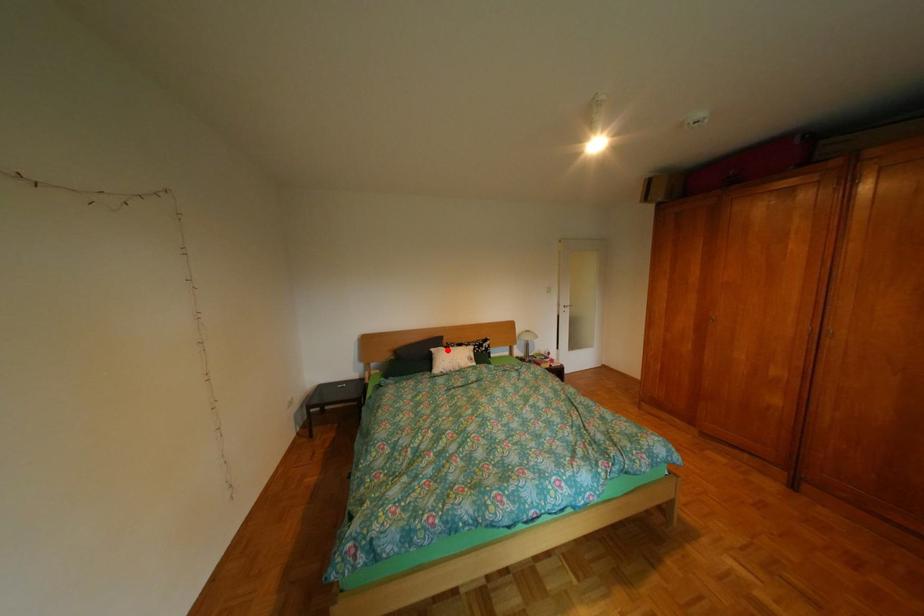
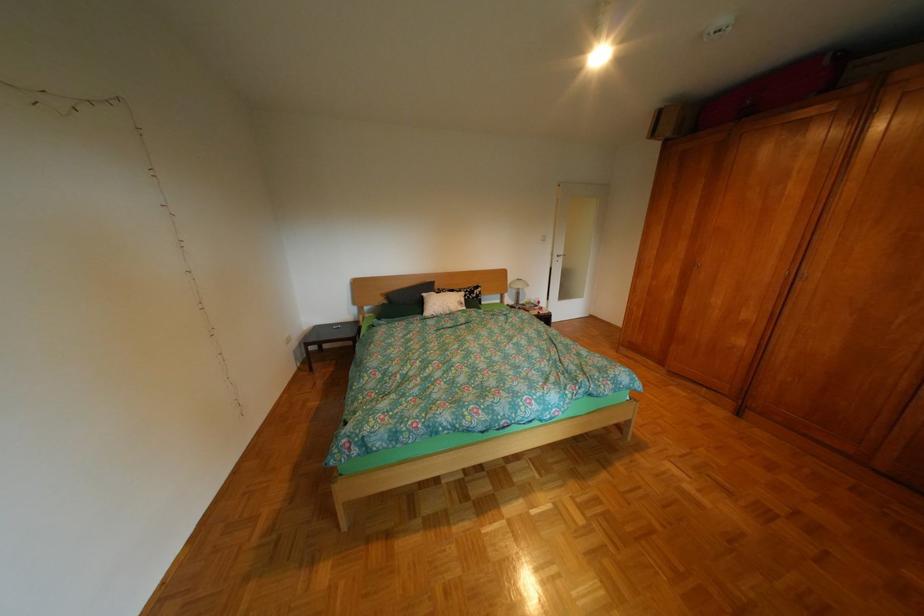
The point at the highlighted location is marked in the first image. Where is the corresponding point in the second image?

(439, 294)